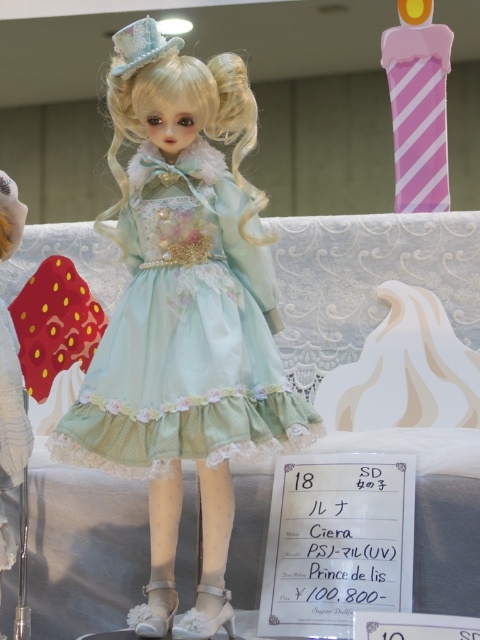
Question: Which of the following is the closest to the observer?

Choices:
 (A) (95, 390)
 (B) (421, 64)
 (C) (3, 454)

Answer: (C)

Question: Is the position of pink striped candle at upper right less distant than that of white lace dress at left?

Choices:
 (A) no
 (B) yes

Answer: (A)

Question: In this image, where is satin light blue dress at center located relative to white lace dress at left?

Choices:
 (A) right
 (B) left

Answer: (A)

Question: Which object is farther from the camera taking this photo?

Choices:
 (A) white lace dress at left
 (B) pink striped candle at upper right

Answer: (B)

Question: Which of these objects is positioned closest to the pink striped candle at upper right?

Choices:
 (A) white lace dress at left
 (B) satin light blue dress at center

Answer: (B)

Question: Does pink striped candle at upper right have a greater width compared to white lace dress at left?

Choices:
 (A) no
 (B) yes

Answer: (B)